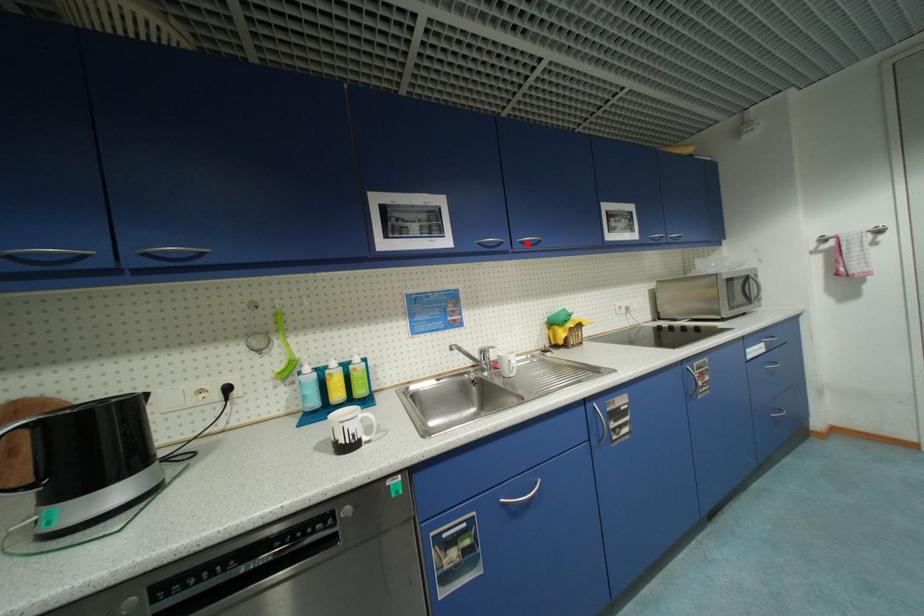
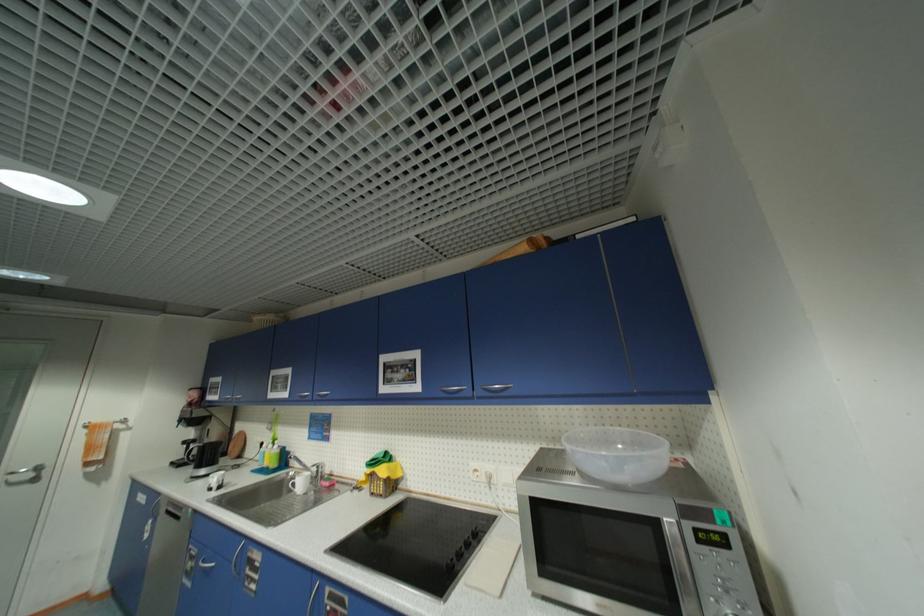
The point at the highlighted location is marked in the first image. Where is the corresponding point in the second image?

(323, 395)